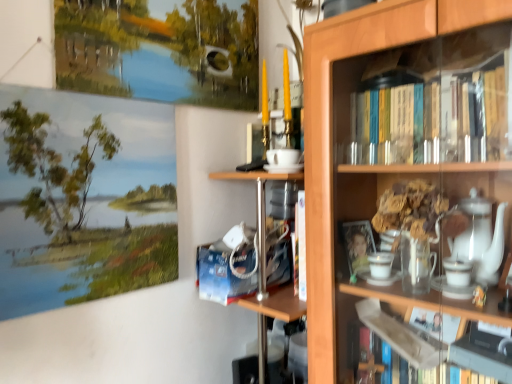
This screenshot has width=512, height=384. What do you see at coordinates (84, 197) in the screenshot?
I see `oil painting landscape at upper left` at bounding box center [84, 197].

You are a GUI agent. You are given a task and a screenshot of the screen. Output one action in this format:
    pyautogui.click(x=<x>, y=<y>)
    Task: Click on the oil painting landscape at upper left
    
    Given the screenshot: What is the action you would take?
    pyautogui.click(x=84, y=197)

The height and width of the screenshot is (384, 512). What do you see at coordinates (400, 171) in the screenshot?
I see `wooden bookcase at upper right` at bounding box center [400, 171].

Identify the location of wooden bookcase at upper right. (400, 171).

Identify the location of oil painting landscape at upper left. (84, 197).

Which is more to the right, wooden bookcase at upper right or oil painting landscape at upper left?

Positioned to the right is wooden bookcase at upper right.

Looking at this image, considering the positions of objects wooden bookcase at upper right and oil painting landscape at upper left in the image provided, who is behind, wooden bookcase at upper right or oil painting landscape at upper left?

oil painting landscape at upper left.

Does point (459, 100) appear closer or farther from the camera than point (67, 285)?

Point (459, 100) is positioned farther from the camera compared to point (67, 285).

From the image's perspective, is wooden bookcase at upper right under oil painting landscape at upper left?

Correct, wooden bookcase at upper right appears lower than oil painting landscape at upper left in the image.

From a real-world perspective, is wooden bookcase at upper right physically below oil painting landscape at upper left?

Correct, in the physical world, wooden bookcase at upper right is lower than oil painting landscape at upper left.

In the scene shown: Considering the relative sizes of wooden bookcase at upper right and oil painting landscape at upper left in the image provided, is wooden bookcase at upper right thinner than oil painting landscape at upper left?

No.

Who is taller, wooden bookcase at upper right or oil painting landscape at upper left?

With more height is wooden bookcase at upper right.

Considering the relative sizes of wooden bookcase at upper right and oil painting landscape at upper left in the image provided, is wooden bookcase at upper right bigger than oil painting landscape at upper left?

Yes, wooden bookcase at upper right is bigger than oil painting landscape at upper left.

Is wooden bookcase at upper right not within oil painting landscape at upper left?

Indeed, wooden bookcase at upper right is completely outside oil painting landscape at upper left.

Is wooden bookcase at upper right far from oil painting landscape at upper left?

No, there isn't a large distance between wooden bookcase at upper right and oil painting landscape at upper left.

Is wooden bookcase at upper right facing towards oil painting landscape at upper left?

Yes, wooden bookcase at upper right is oriented towards oil painting landscape at upper left.

How different are the orientations of wooden bookcase at upper right and oil painting landscape at upper left in degrees?

wooden bookcase at upper right and oil painting landscape at upper left are facing 89.4 degrees away from each other.

Locate an element on the screen. bookcase located in front of the oil painting landscape at upper left is located at coordinates (400, 171).

Does oil painting landscape at upper left appear on the right side of wooden bookcase at upper right?

No, oil painting landscape at upper left is not to the right of wooden bookcase at upper right.

Does oil painting landscape at upper left lie behind wooden bookcase at upper right?

Yes, the depth of oil painting landscape at upper left is greater than that of wooden bookcase at upper right.

Is point (45, 202) in front of point (421, 206)?

Yes.

From the image's perspective, which object appears higher, oil painting landscape at upper left or wooden bookcase at upper right?

oil painting landscape at upper left is shown above in the image.

From a real-world perspective, is oil painting landscape at upper left positioned under wooden bookcase at upper right based on gravity?

No.

Considering the sizes of oil painting landscape at upper left and wooden bookcase at upper right in the image, is oil painting landscape at upper left wider or thinner than wooden bookcase at upper right?

Considering their sizes, oil painting landscape at upper left looks slimmer than wooden bookcase at upper right.

Considering the relative sizes of oil painting landscape at upper left and wooden bookcase at upper right in the image provided, is oil painting landscape at upper left shorter than wooden bookcase at upper right?

Yes, oil painting landscape at upper left is shorter than wooden bookcase at upper right.

Who is bigger, oil painting landscape at upper left or wooden bookcase at upper right?

wooden bookcase at upper right.

Is oil painting landscape at upper left completely or partially outside of wooden bookcase at upper right?

Absolutely, oil painting landscape at upper left is external to wooden bookcase at upper right.

Is oil painting landscape at upper left touching wooden bookcase at upper right?

They are not placed beside each other.

Is oil painting landscape at upper left positioned with its back to wooden bookcase at upper right?

That's not correct — oil painting landscape at upper left is not looking away from wooden bookcase at upper right.

In the scene shown: How many degrees apart are the facing directions of oil painting landscape at upper left and wooden bookcase at upper right?

The angle between the facing direction of oil painting landscape at upper left and the facing direction of wooden bookcase at upper right is 89.4 degrees.

Locate an element on the screen. The image size is (512, 384). bookcase below the oil painting landscape at upper left (from a real-world perspective) is located at coordinates (400, 171).

Where is `picture frame that is above the wooden bookcase at upper right (from a real-world perspective)`? This screenshot has height=384, width=512. picture frame that is above the wooden bookcase at upper right (from a real-world perspective) is located at coordinates (84, 197).

Locate an element on the screen. Image resolution: width=512 pixels, height=384 pixels. bookcase in front of the oil painting landscape at upper left is located at coordinates (400, 171).